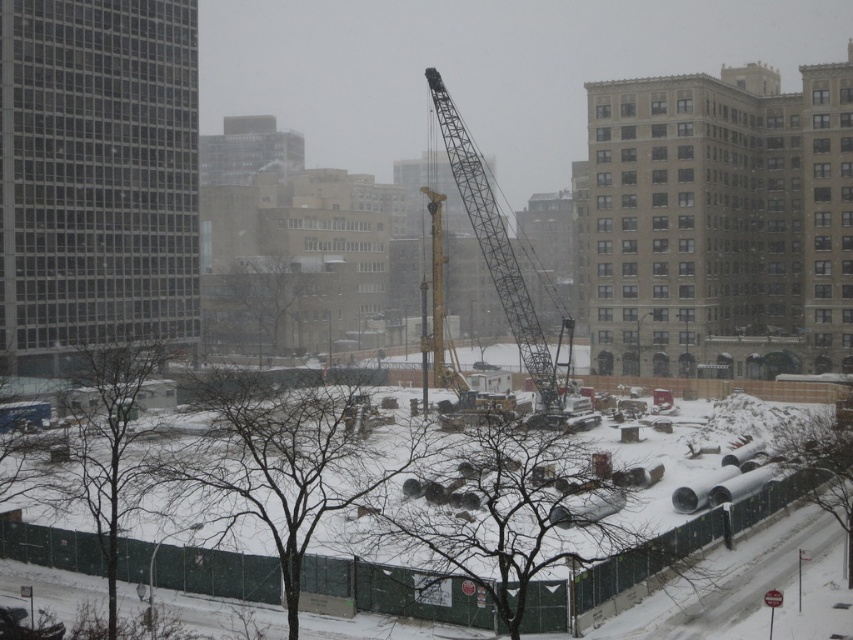
You are a construction worker who needs to move a heavy load from the snowy concrete pipes at center to the metallic gray crane at center. Which direction should you move the load to reach the crane?

The snowy concrete pipes at center is on the left side of the metallic gray crane at center, so you should move the load to the right to reach the crane.

You are a construction worker standing at the camera position. You need to move the snowy concrete pipes at center to a storage area located 150 feet away from the camera. Can you reach the pipes without moving more than 150 feet from the camera?

The snowy concrete pipes at center are 135.48 feet away from the camera. Since the storage area is 150 feet away, you can reach the pipes without exceeding the 150 feet limit.

You are a construction worker who needs to transport a large equipment that requires a crane. Looking at the image, can the yellow metallic crane at center lift the equipment if the snowy concrete pipes at center are blocking the path?

The snowy concrete pipes at center is bigger than yellow metallic crane at center, so the crane might not be able to lift the equipment due to the obstruction caused by the larger pipes.